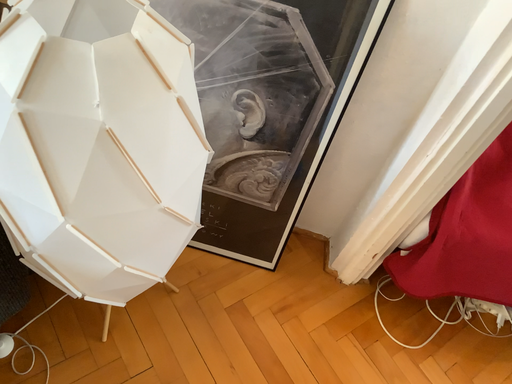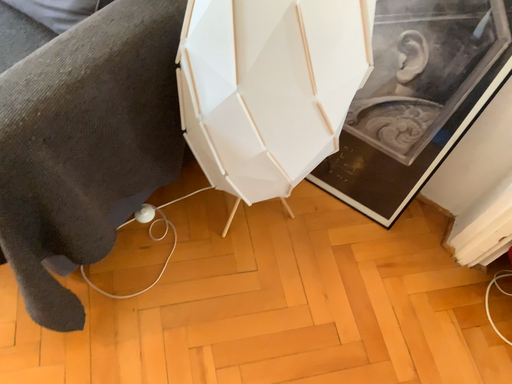
Question: How did the camera likely rotate when shooting the video?

Choices:
 (A) rotated left
 (B) rotated right

Answer: (A)